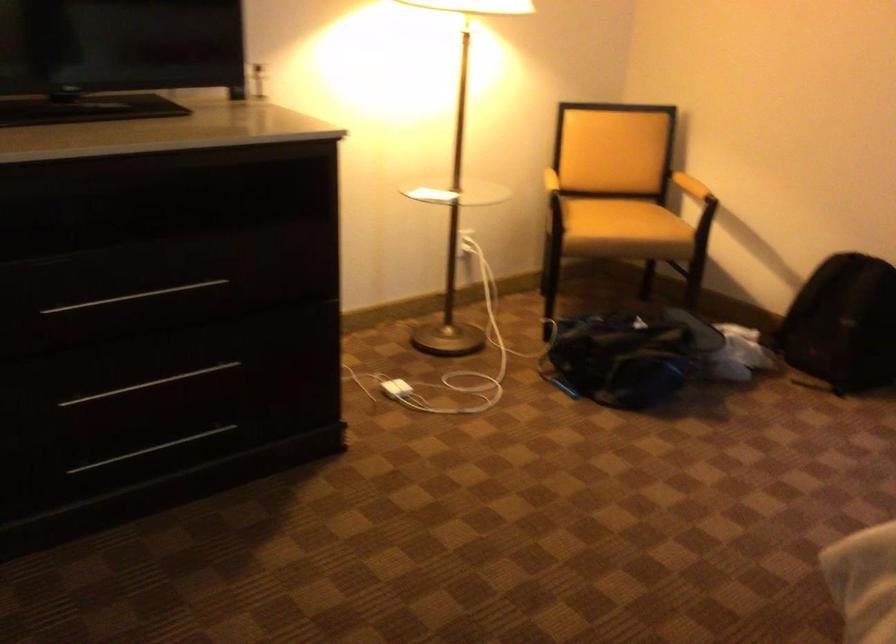
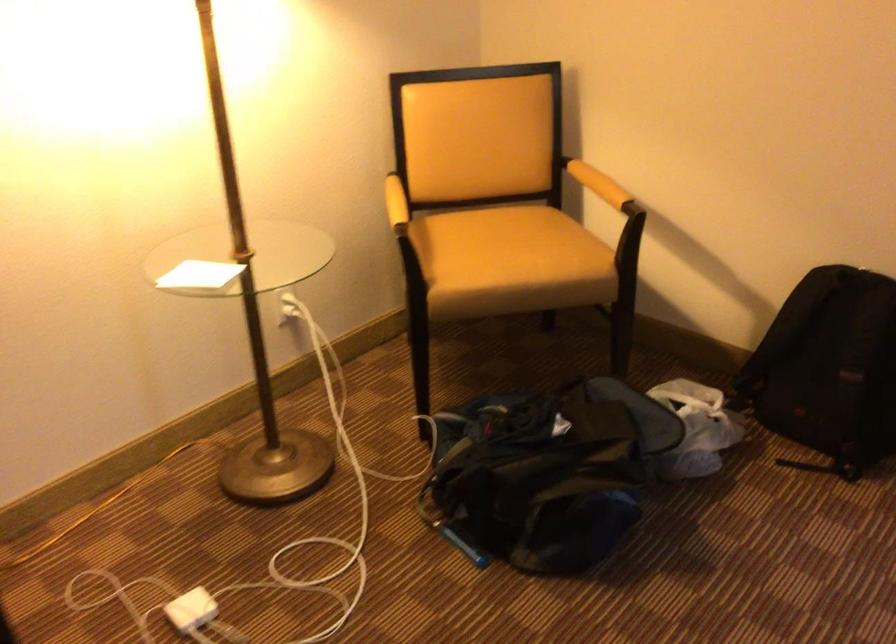
Where in the second image is the point corresponding to (x=615, y=348) from the first image?

(537, 480)